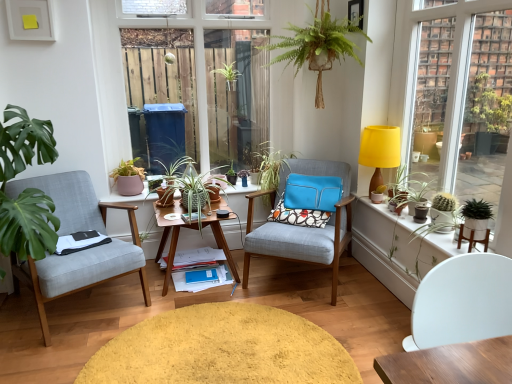
In order to click on blank area to the left of matte black coffee cup at center in this screenshot , I will do `click(198, 211)`.